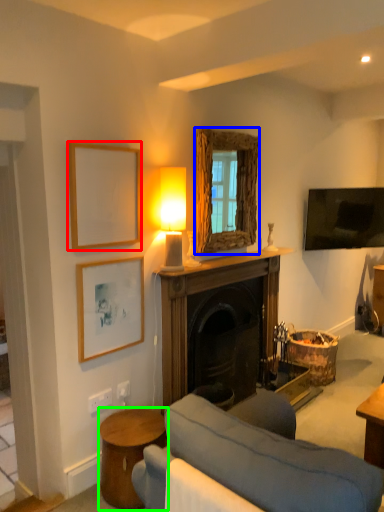
Question: Which object is positioned closest to picture frame (highlighted by a red box)? Select from window screen (highlighted by a blue box) and table (highlighted by a green box).

Choices:
 (A) window screen
 (B) table

Answer: (A)